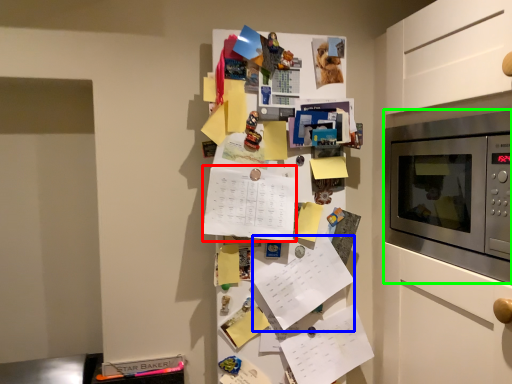
Question: Which is farther away from list (highlighted by a red box)? list (highlighted by a blue box) or microwave oven (highlighted by a green box)?

Choices:
 (A) list
 (B) microwave oven

Answer: (B)